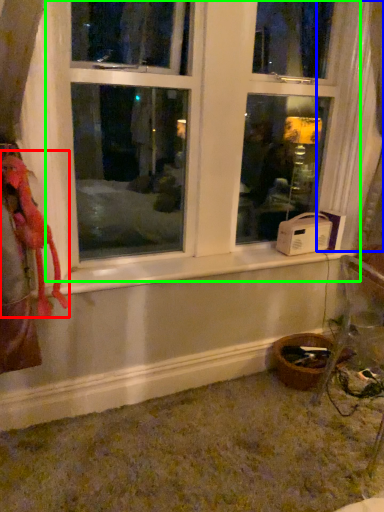
Question: Considering the real-world distances, which object is closest to animal (highlighted by a red box)? curtain (highlighted by a blue box) or window (highlighted by a green box).

Choices:
 (A) curtain
 (B) window

Answer: (B)